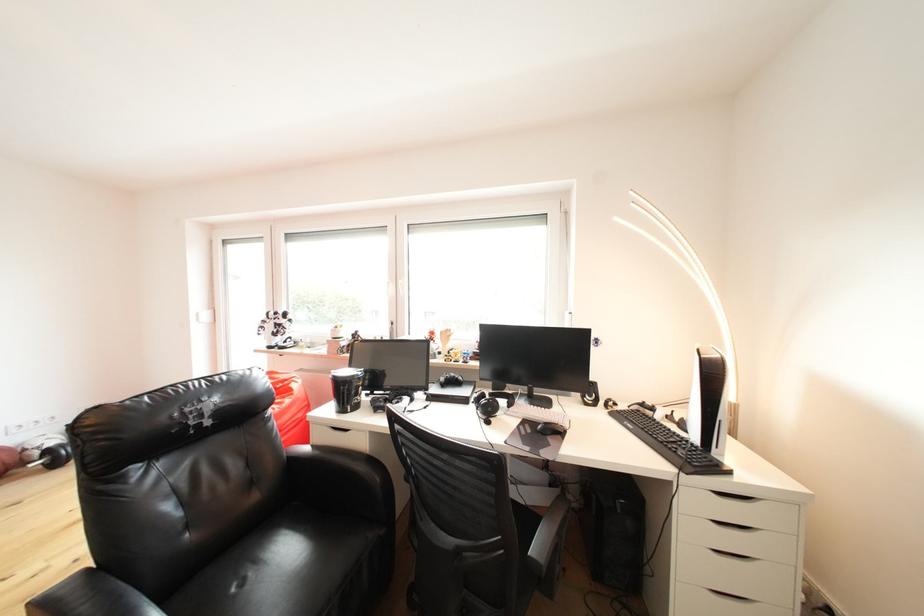
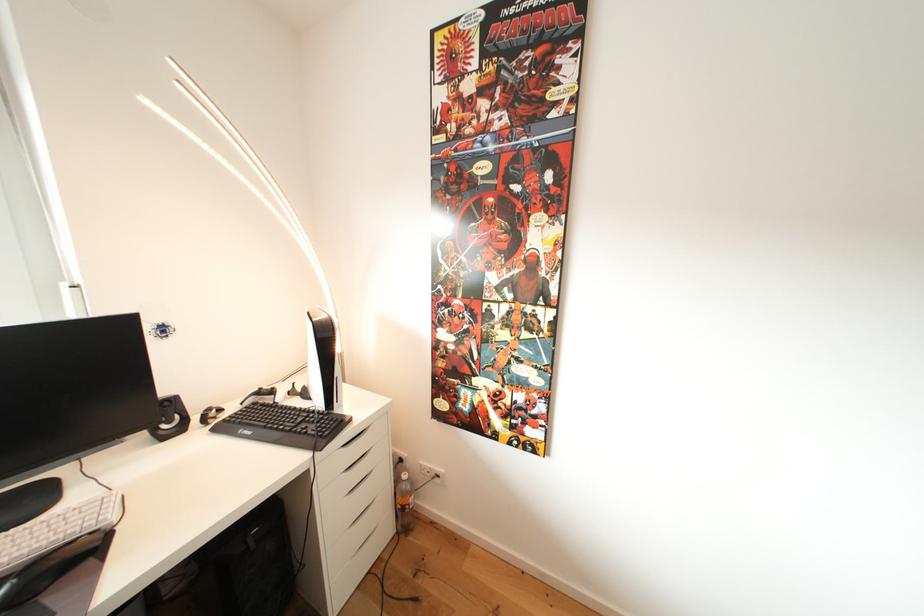
Find the pixel in the second image that matches [651,410] in the first image.

(268, 398)